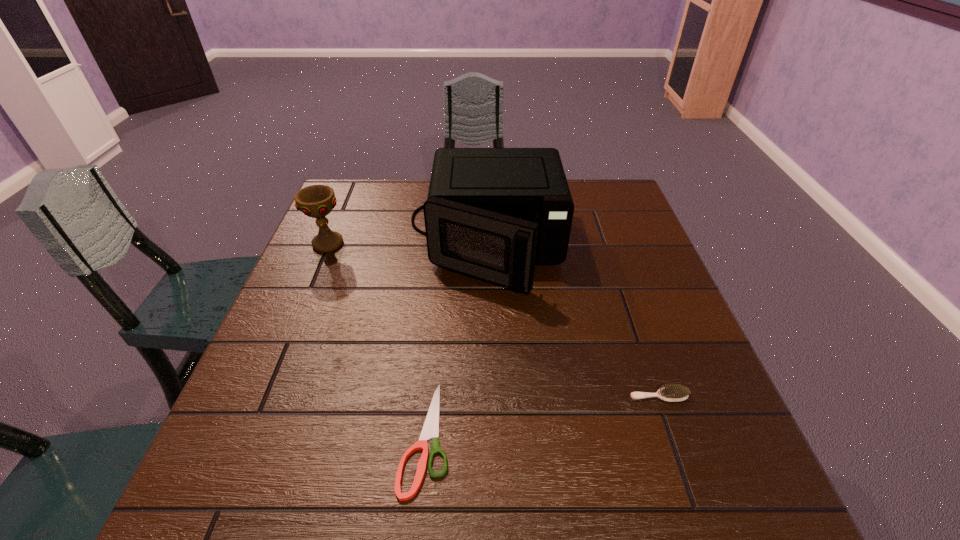
The image size is (960, 540). I want to click on object present at the far edge, so click(x=490, y=213).

The height and width of the screenshot is (540, 960). In order to click on object at the near edge in this screenshot , I will do `click(430, 429)`.

At what (x,y) coordinates should I click in order to perform the action: click on object at the left edge. Please return your answer as a coordinate pair (x, y). Looking at the image, I should click on (316, 201).

Where is `object at the right edge`? object at the right edge is located at coordinates (673, 393).

The width and height of the screenshot is (960, 540). In the image, there is a desktop. What are the coordinates of `vacant space at the far edge` in the screenshot? It's located at (423, 201).

This screenshot has height=540, width=960. Find the location of `blank space at the near edge of the desktop`. blank space at the near edge of the desktop is located at coordinates (619, 513).

Find the location of a particular element. vacant space at the left edge of the desktop is located at coordinates (253, 396).

Image resolution: width=960 pixels, height=540 pixels. What are the coordinates of `free spot at the right edge of the desktop` in the screenshot? It's located at (738, 457).

Identify the location of blank space at the far left corner. The width and height of the screenshot is (960, 540). (376, 197).

Identify the location of free space at the near left corner of the desktop. (252, 487).